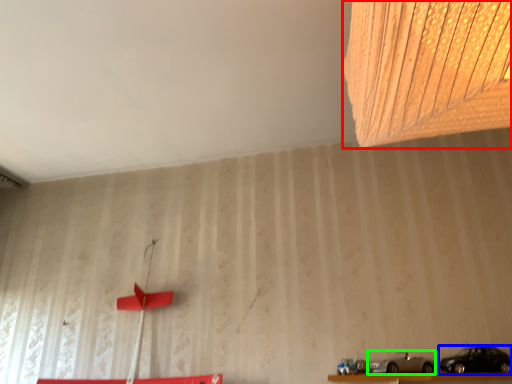
Question: Which object is the closest to the lamp (highlighted by a red box)? Choose among these: car (highlighted by a blue box) or car (highlighted by a green box).

Choices:
 (A) car
 (B) car

Answer: (A)